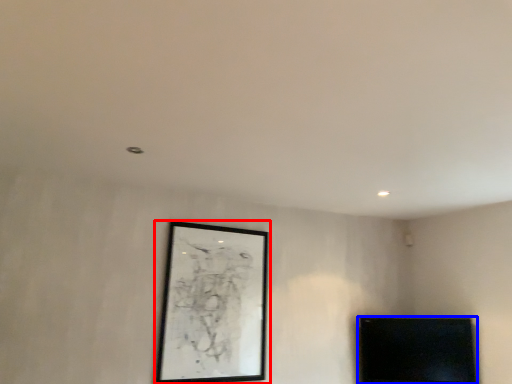
Question: Which object appears closest to the camera in this image, picture frame (highlighted by a red box) or furniture (highlighted by a blue box)?

Choices:
 (A) picture frame
 (B) furniture

Answer: (A)